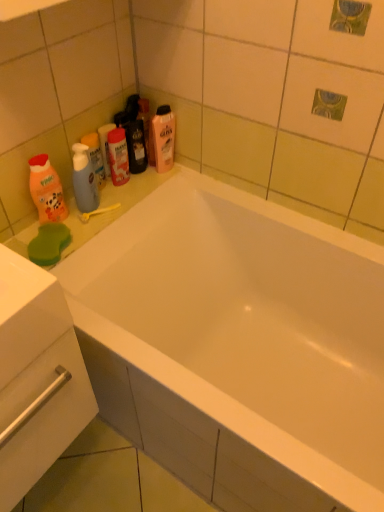
Measure the distance between point (81,140) and camera.

Point (81,140) and camera are 1.26 meters apart.

Describe the element at coordinates (237, 347) in the screenshot. I see `white glossy bathtub at center` at that location.

Locate an element on the screen. orange matte bottle at left, placed as the 1th cleaning product when sorted from left to right is located at coordinates (46, 190).

Where is `translucent plastic mouthwash at upper left, which is the second mouthwash from right to left`? Image resolution: width=384 pixels, height=512 pixels. translucent plastic mouthwash at upper left, which is the second mouthwash from right to left is located at coordinates (95, 156).

Considering their positions, is translucent plastic mouthwash at upper left, which is the second mouthwash from right to left, located in front of or behind white glossy bathtub at center?

In the image, translucent plastic mouthwash at upper left, which is the second mouthwash from right to left, appears behind white glossy bathtub at center.

Where is `mouthwash that is the 1st one when counting upward from the white glossy bathtub at center (from the image's perspective)`? This screenshot has height=512, width=384. mouthwash that is the 1st one when counting upward from the white glossy bathtub at center (from the image's perspective) is located at coordinates (95, 156).

Considering the points (95, 145) and (194, 406), which point is in front, point (95, 145) or point (194, 406)?

The point (194, 406) is closer to the camera.

In the scene shown: Measure the distance between translucent plastic bottle at upper center, which appears as the first cleaning product when viewed from the right, and translucent plastic mouthwash at upper center, marked as the first mouthwash in a right-to-left arrangement.

They are 4.85 inches apart.

Is point (159, 136) closer or farther from the camera than point (122, 183)?

Clearly, point (159, 136) is closer to the camera than point (122, 183).

Looking at the image, does translucent plastic bottle at upper center, the 2th cleaning product when ordered from left to right, seem bigger or smaller compared to translucent plastic mouthwash at upper center, marked as the first mouthwash in a right-to-left arrangement?

translucent plastic bottle at upper center, the 2th cleaning product when ordered from left to right, is bigger than translucent plastic mouthwash at upper center, marked as the first mouthwash in a right-to-left arrangement.

From a real-world perspective, is translucent plastic mouthwash at upper left, which is the second mouthwash from right to left, positioned above or below translucent plastic mouthwash at upper center, marked as the first mouthwash in a right-to-left arrangement?

translucent plastic mouthwash at upper left, which is the second mouthwash from right to left, is situated lower than translucent plastic mouthwash at upper center, marked as the first mouthwash in a right-to-left arrangement, in the real world.

Is translucent plastic mouthwash at upper left, which appears as the first mouthwash when viewed from the left, inside the boundaries of translucent plastic mouthwash at upper center, marked as the second mouthwash in a left-to-right arrangement, or outside?

translucent plastic mouthwash at upper left, which appears as the first mouthwash when viewed from the left, exists outside the volume of translucent plastic mouthwash at upper center, marked as the second mouthwash in a left-to-right arrangement.

Which is closer, (93, 157) or (112, 151)?

The point (93, 157) is more forward.

Would you say yellow plastic toothbrush at upper left is a long distance from translucent plastic mouthwash at upper center, marked as the first mouthwash in a right-to-left arrangement?

That's not correct — yellow plastic toothbrush at upper left is a little close to translucent plastic mouthwash at upper center, marked as the first mouthwash in a right-to-left arrangement.

Is yellow plastic toothbrush at upper left wider than translucent plastic mouthwash at upper center, marked as the second mouthwash in a left-to-right arrangement?

Indeed, yellow plastic toothbrush at upper left has a greater width compared to translucent plastic mouthwash at upper center, marked as the second mouthwash in a left-to-right arrangement.

Which object is further away from the camera taking this photo, yellow plastic toothbrush at upper left or translucent plastic mouthwash at upper center, marked as the second mouthwash in a left-to-right arrangement?

→ Positioned behind is translucent plastic mouthwash at upper center, marked as the second mouthwash in a left-to-right arrangement.

Could you tell me if yellow plastic toothbrush at upper left is turned towards translucent plastic mouthwash at upper center, marked as the second mouthwash in a left-to-right arrangement?

No, yellow plastic toothbrush at upper left is not turned towards translucent plastic mouthwash at upper center, marked as the second mouthwash in a left-to-right arrangement.

Between orange matte bottle at left, placed as the 1th cleaning product when sorted from left to right, and yellow plastic toothbrush at upper left, which one appears on the left side from the viewer's perspective?

orange matte bottle at left, placed as the 1th cleaning product when sorted from left to right, is more to the left.

Is orange matte bottle at left, the 2th cleaning product from the top, behind yellow plastic toothbrush at upper left?

No, the depth of orange matte bottle at left, the 2th cleaning product from the top, is less than that of yellow plastic toothbrush at upper left.

Looking at this image, considering the sizes of orange matte bottle at left, arranged as the 2th cleaning product when viewed from the back, and yellow plastic toothbrush at upper left in the image, is orange matte bottle at left, arranged as the 2th cleaning product when viewed from the back, wider or thinner than yellow plastic toothbrush at upper left?

Clearly, orange matte bottle at left, arranged as the 2th cleaning product when viewed from the back, has less width compared to yellow plastic toothbrush at upper left.

Looking at this image, is white glossy drawer at lower left oriented towards translucent plastic bottle at upper center, the 2th cleaning product from the front?

No, white glossy drawer at lower left does not turn towards translucent plastic bottle at upper center, the 2th cleaning product from the front.

From the image's perspective, which object appears higher, white glossy drawer at lower left or translucent plastic bottle at upper center, positioned as the 1th cleaning product in back-to-front order?

translucent plastic bottle at upper center, positioned as the 1th cleaning product in back-to-front order, appears higher in the image.

Is point (41, 392) less distant than point (149, 160)?

That is True.

Is white glossy drawer at lower left to the left of translucent plastic bottle at upper center, the 2th cleaning product when ordered from left to right, from the viewer's perspective?

Yes.

What's the angular difference between yellow plastic toothbrush at upper left and white glossy bathtub at center's facing directions?

yellow plastic toothbrush at upper left and white glossy bathtub at center are facing 63.5 degrees away from each other.

Identify the location of bathtub on the right of yellow plastic toothbrush at upper left. (237, 347).

In the scene shown: Does yellow plastic toothbrush at upper left lie behind white glossy bathtub at center?

That is True.

Is white glossy bathtub at center surrounded by yellow plastic toothbrush at upper left?

That's incorrect, white glossy bathtub at center is not inside yellow plastic toothbrush at upper left.

Where is `bathtub below the translucent plastic mouthwash at upper left, which is the second mouthwash from right to left (from a real-world perspective)`? Image resolution: width=384 pixels, height=512 pixels. bathtub below the translucent plastic mouthwash at upper left, which is the second mouthwash from right to left (from a real-world perspective) is located at coordinates (237, 347).

This screenshot has width=384, height=512. Identify the location of the 1st mouthwash in front of the translucent plastic bottle at upper center, positioned as the 1th cleaning product in back-to-front order, starting your count from the anchor. (118, 156).

When comparing their distances from translucent plastic mouthwash at upper center, marked as the first mouthwash in a right-to-left arrangement, does white glossy drawer at lower left or translucent plastic mouthwash at upper left, which is the second mouthwash from right to left, seem closer?

Among the two, translucent plastic mouthwash at upper left, which is the second mouthwash from right to left, is located nearer to translucent plastic mouthwash at upper center, marked as the first mouthwash in a right-to-left arrangement.

From the picture: Considering their positions, is yellow plastic toothbrush at upper left positioned further to translucent plastic mouthwash at upper center, marked as the second mouthwash in a left-to-right arrangement, than white glossy drawer at lower left?

white glossy drawer at lower left.

From the image, which object appears to be nearer to white glossy bathtub at center, yellow plastic toothbrush at upper left or translucent plastic bottle at upper center, placed as the second cleaning product when sorted from bottom to top?

Among the two, yellow plastic toothbrush at upper left is located nearer to white glossy bathtub at center.

Estimate the real-world distances between objects in this image. Which object is closer to white glossy bathtub at center, translucent plastic mouthwash at upper center, marked as the second mouthwash in a left-to-right arrangement, or translucent plastic mouthwash at upper left, which is the second mouthwash from right to left?

The object closer to white glossy bathtub at center is translucent plastic mouthwash at upper center, marked as the second mouthwash in a left-to-right arrangement.

Estimate the real-world distances between objects in this image. Which object is further from white glossy drawer at lower left, yellow plastic toothbrush at upper left or translucent plastic bottle at upper center, the 2th cleaning product from the front?

translucent plastic bottle at upper center, the 2th cleaning product from the front, is positioned further to the anchor white glossy drawer at lower left.

Considering their positions, is white glossy bathtub at center positioned further to translucent plastic bottle at upper center, the 2th cleaning product when ordered from left to right, than translucent plastic mouthwash at upper center, marked as the second mouthwash in a left-to-right arrangement?

Based on the image, white glossy bathtub at center appears to be further to translucent plastic bottle at upper center, the 2th cleaning product when ordered from left to right.

From the image, which object appears to be farther from translucent plastic bottle at upper center, positioned as the 1th cleaning product in back-to-front order, translucent plastic mouthwash at upper left, which appears as the first mouthwash when viewed from the left, or white glossy bathtub at center?

Among the two, white glossy bathtub at center is located further to translucent plastic bottle at upper center, positioned as the 1th cleaning product in back-to-front order.

From the image, which object appears to be nearer to translucent plastic mouthwash at upper left, which appears as the first mouthwash when viewed from the left, orange matte bottle at left, the 2th cleaning product from the top, or translucent plastic bottle at upper center, the 2th cleaning product from the front?

orange matte bottle at left, the 2th cleaning product from the top, is closer to translucent plastic mouthwash at upper left, which appears as the first mouthwash when viewed from the left.

This screenshot has width=384, height=512. Identify the location of towel bar located between orange matte bottle at left, the 2th cleaning product when ordered from right to left, and white glossy bathtub at center in the left-right direction. (98, 212).

Where is `cleaning product between white glossy drawer at lower left and translucent plastic bottle at upper center, the 2th cleaning product when ordered from left to right, along the z-axis`? The height and width of the screenshot is (512, 384). cleaning product between white glossy drawer at lower left and translucent plastic bottle at upper center, the 2th cleaning product when ordered from left to right, along the z-axis is located at coordinates (46, 190).

Find the location of a particular element. Image resolution: width=384 pixels, height=512 pixels. mouthwash located between orange matte bottle at left, placed as the 1th cleaning product when sorted from left to right, and translucent plastic mouthwash at upper center, marked as the second mouthwash in a left-to-right arrangement, in the depth direction is located at coordinates (95, 156).

The height and width of the screenshot is (512, 384). In order to click on cleaning product positioned between white glossy drawer at lower left and yellow plastic toothbrush at upper left from near to far in this screenshot , I will do `click(46, 190)`.